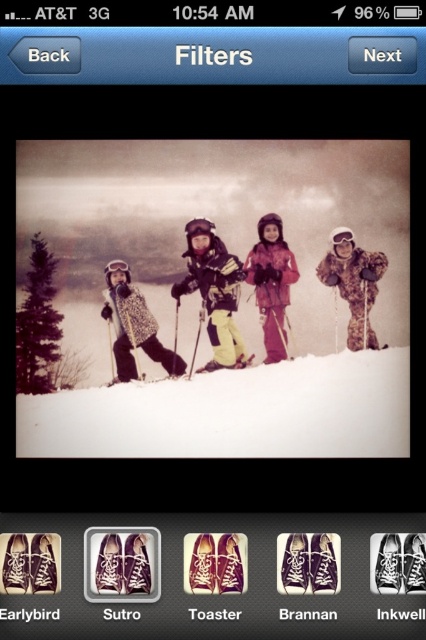
Question: Among these points, which one is nearest to the camera?

Choices:
 (A) (371, 253)
 (B) (264, 218)

Answer: (A)

Question: Which point appears closest to the camera in this image?

Choices:
 (A) (275, 241)
 (B) (221, 253)

Answer: (A)

Question: Does white powder snow at center have a greater width compared to yellow matte ski at center?

Choices:
 (A) yes
 (B) no

Answer: (A)

Question: Is white powder snow at center further to the viewer compared to camouflage snow pants at center?

Choices:
 (A) no
 (B) yes

Answer: (A)

Question: Which point is closer to the camera taking this photo?

Choices:
 (A) (256, 294)
 (B) (224, 420)
 (C) (124, 276)
 (D) (212, 364)

Answer: (B)

Question: Does white powder snow at center have a larger size compared to leather jacket at left?

Choices:
 (A) no
 (B) yes

Answer: (B)